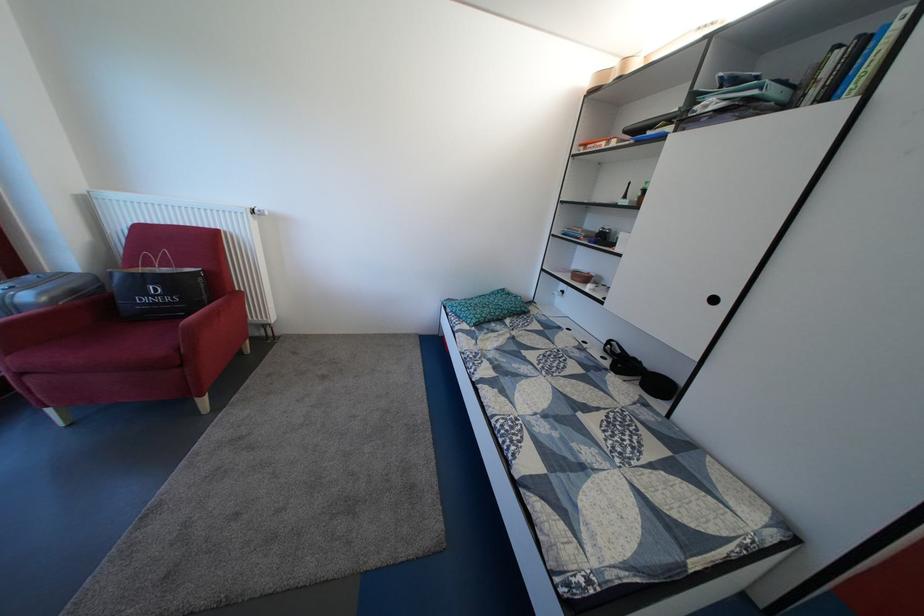
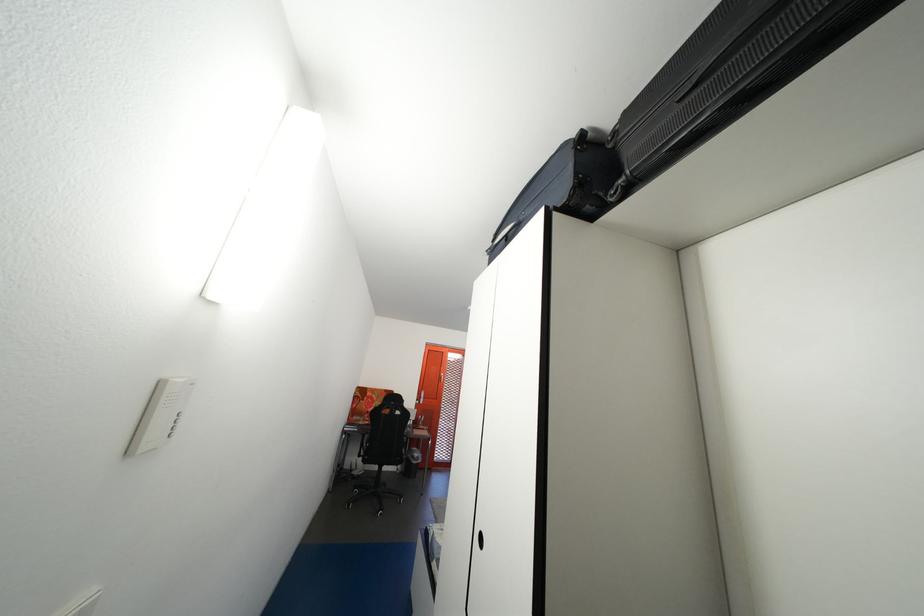
Question: I am providing you with two images of the same scene from different viewpoints. Which of the following objects are not visible in image2?

Choices:
 (A) whiteboard sliding handle
 (B) chair sitting surface
 (C) black recessed handle
 (D) red chair armrest

Answer: (D)